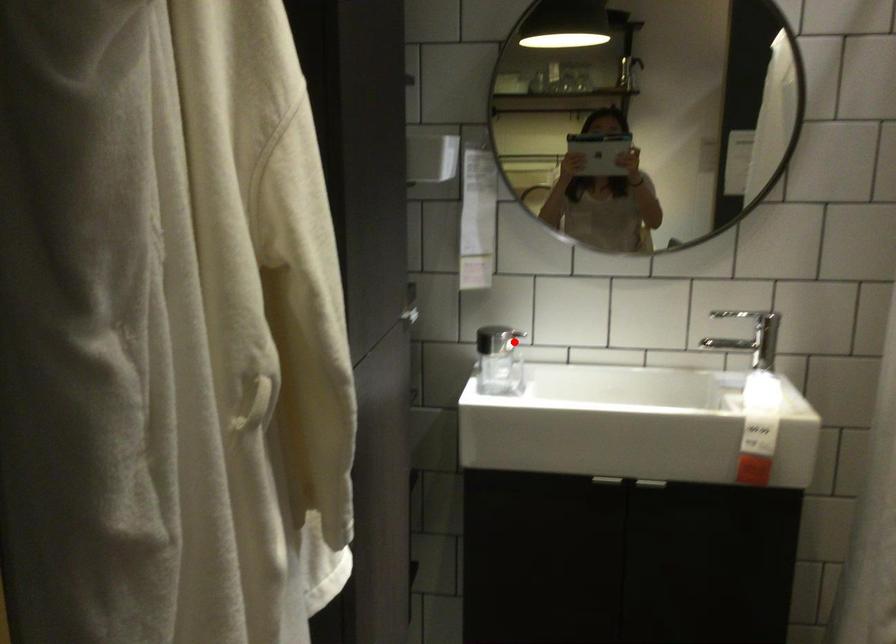
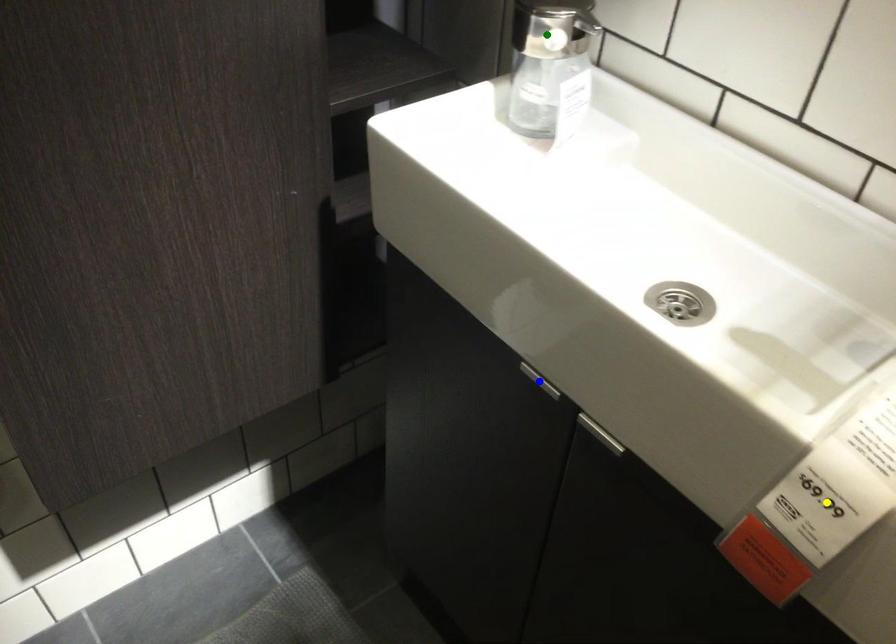
Question: I am providing you with two images of the same scene from different viewpoints. A red point is marked on the first image. You are given multiple points on the second image. Which spot in image 2 lines up with the point in image 1?

Choices:
 (A) green point
 (B) blue point
 (C) yellow point

Answer: (A)